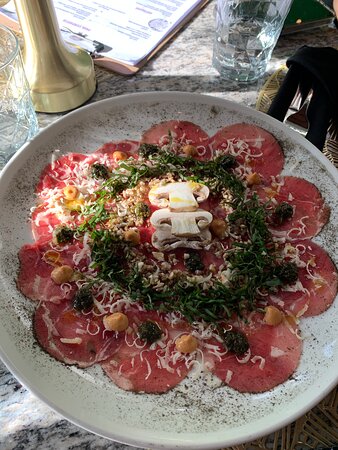
Locate an element on the screen. napkin is located at coordinates (320, 78).